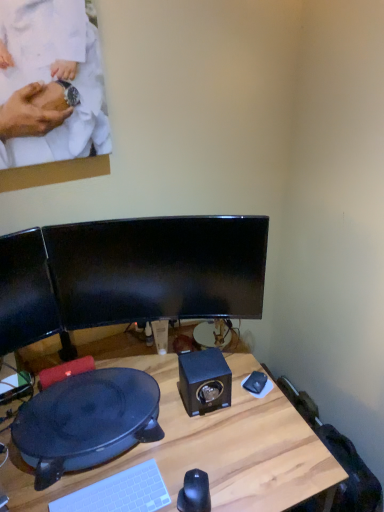
You are a GUI agent. You are given a task and a screenshot of the screen. Output one action in this format:
    pyautogui.click(x=<x>, y=<y>)
    Task: Click on the empty space that is ontop of wooden desk at center (from a real-world perspective)
    This screenshot has height=512, width=384.
    Given the screenshot: What is the action you would take?
    pyautogui.click(x=152, y=438)